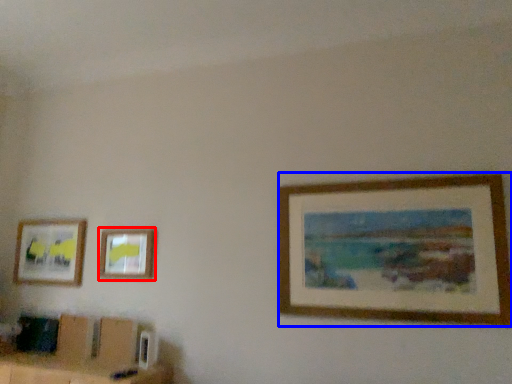
Question: Which object is further to the camera taking this photo, picture frame (highlighted by a red box) or picture frame (highlighted by a blue box)?

Choices:
 (A) picture frame
 (B) picture frame

Answer: (A)